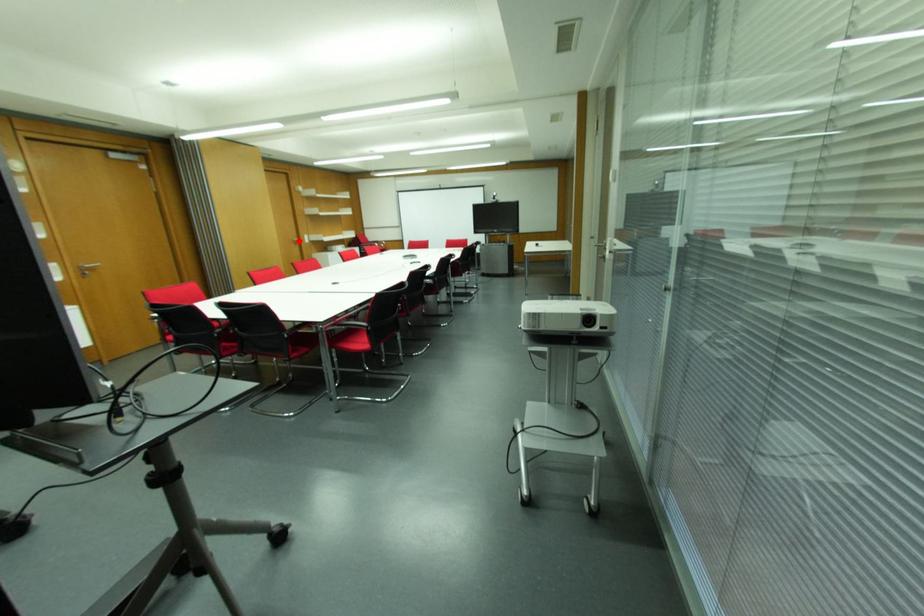
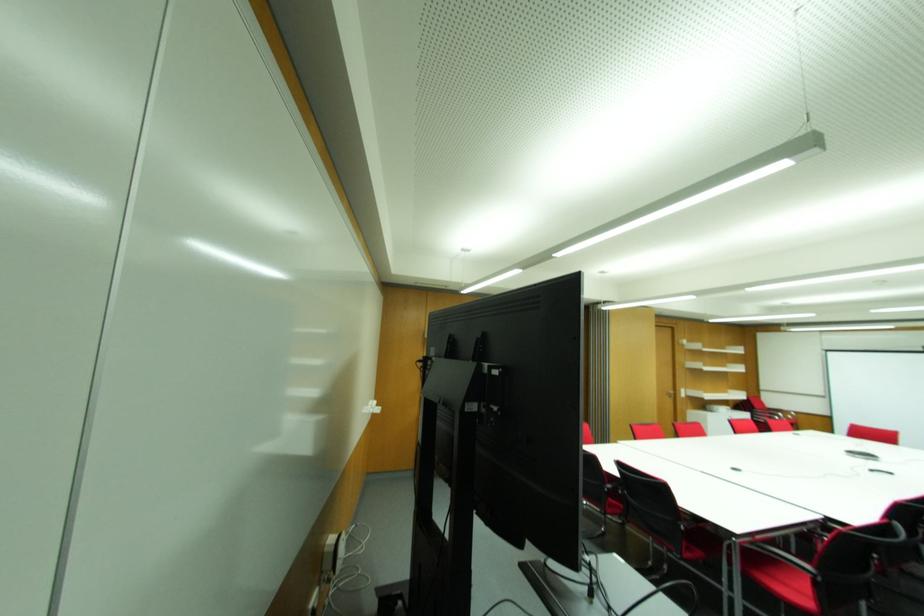
Question: I am providing you with two images of the same scene from different viewpoints. Given a red point in image1, look at the same physical point in image2. Is it:

Choices:
 (A) Closer to the viewpoint
 (B) Farther from the viewpoint

Answer: (B)